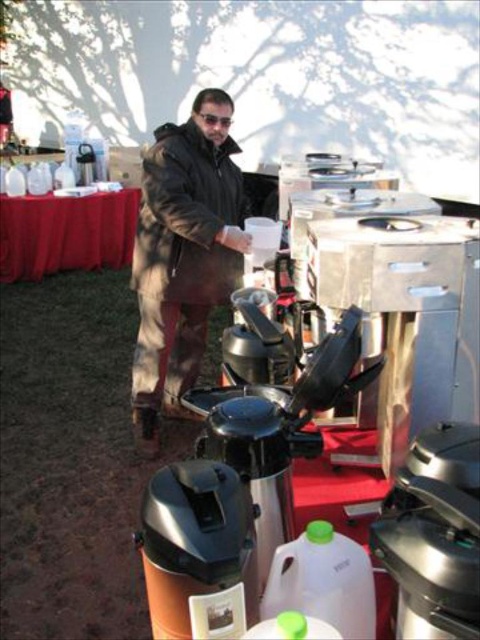
Which of these two, stainless steel coffee maker at center or brushed metal coffee pot at center, stands shorter?

With less height is brushed metal coffee pot at center.

Between point (470, 397) and point (468, 488), which one is positioned behind?

Positioned behind is point (470, 397).

Locate an element on the screen. The width and height of the screenshot is (480, 640). stainless steel coffee maker at center is located at coordinates [x=406, y=314].

Is brushed metal coffee pot at center further to camera compared to orange matte thermos at center?

No, it is in front of orange matte thermos at center.

Between brushed metal coffee pot at center and orange matte thermos at center, which one is positioned higher?

Positioned higher is brushed metal coffee pot at center.

Image resolution: width=480 pixels, height=640 pixels. What do you see at coordinates (434, 534) in the screenshot? I see `brushed metal coffee pot at center` at bounding box center [434, 534].

Where is `brushed metal coffee pot at center`? brushed metal coffee pot at center is located at coordinates (434, 534).

Is orange matte thermos at center wider than red satin tablecloth at left?

No, orange matte thermos at center is not wider than red satin tablecloth at left.

Find the location of a particular element. This screenshot has width=480, height=640. orange matte thermos at center is located at coordinates (x=195, y=541).